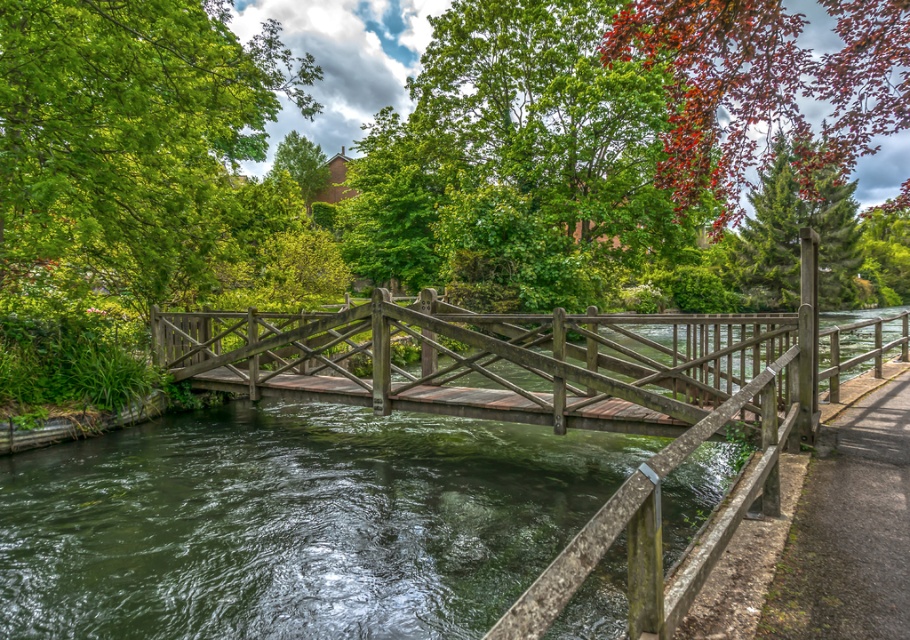
Question: Which object is farther from the camera taking this photo?

Choices:
 (A) brown wooden path at lower right
 (B) green mossy water at center
 (C) reddish-brown bark tree at upper right

Answer: (C)

Question: Does green leafy tree at upper left appear over reddish-brown bark tree at upper right?

Choices:
 (A) no
 (B) yes

Answer: (A)

Question: Which of the following is the closest to the observer?

Choices:
 (A) (887, 493)
 (B) (301, 349)

Answer: (A)

Question: Can you confirm if green leafy tree at upper left is positioned to the right of reddish-brown bark tree at upper right?

Choices:
 (A) no
 (B) yes

Answer: (A)

Question: Which of these objects is positioned closest to the green mossy water at center?

Choices:
 (A) green leafy tree at upper left
 (B) wooden bridge at center
 (C) brown wooden path at lower right
 (D) reddish-brown bark tree at upper right

Answer: (B)

Question: Observing the image, what is the correct spatial positioning of green mossy water at center in reference to wooden bridge at center?

Choices:
 (A) below
 (B) above

Answer: (A)